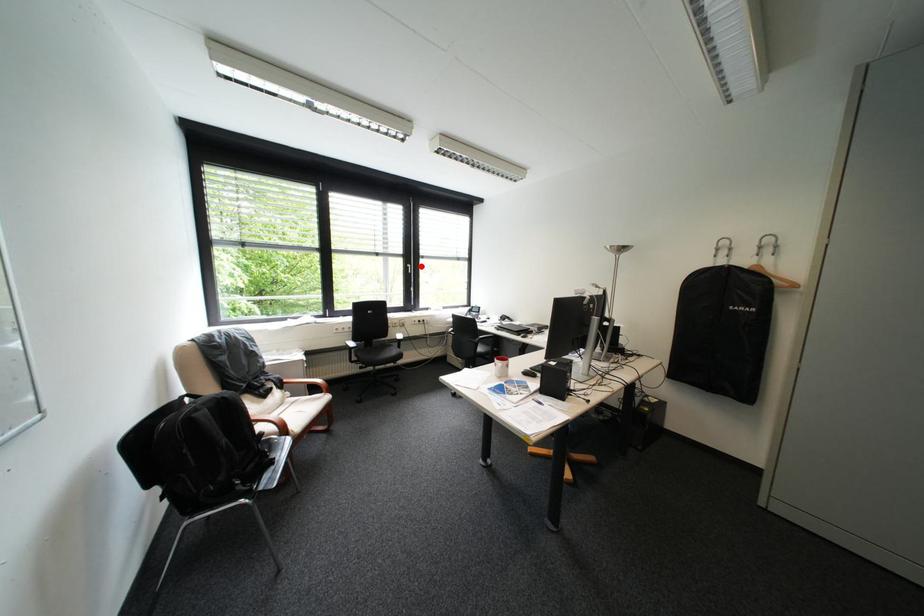
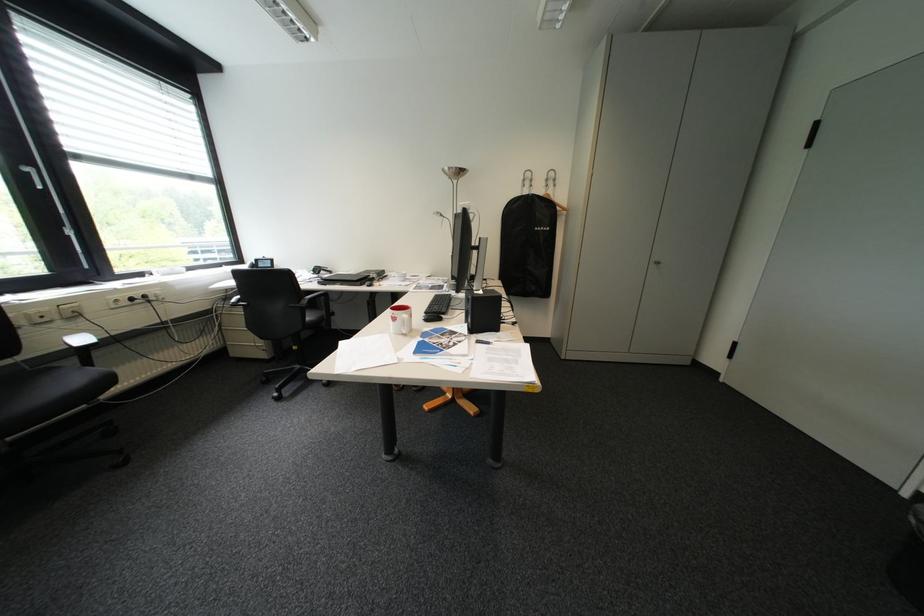
In the second image, find the point that corresponds to the highlighted location in the first image.

(41, 169)